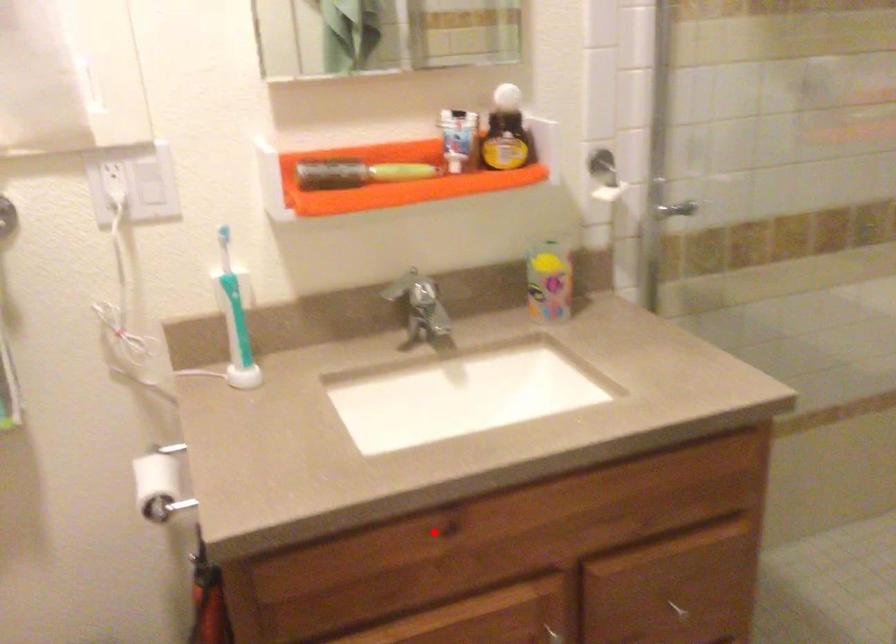
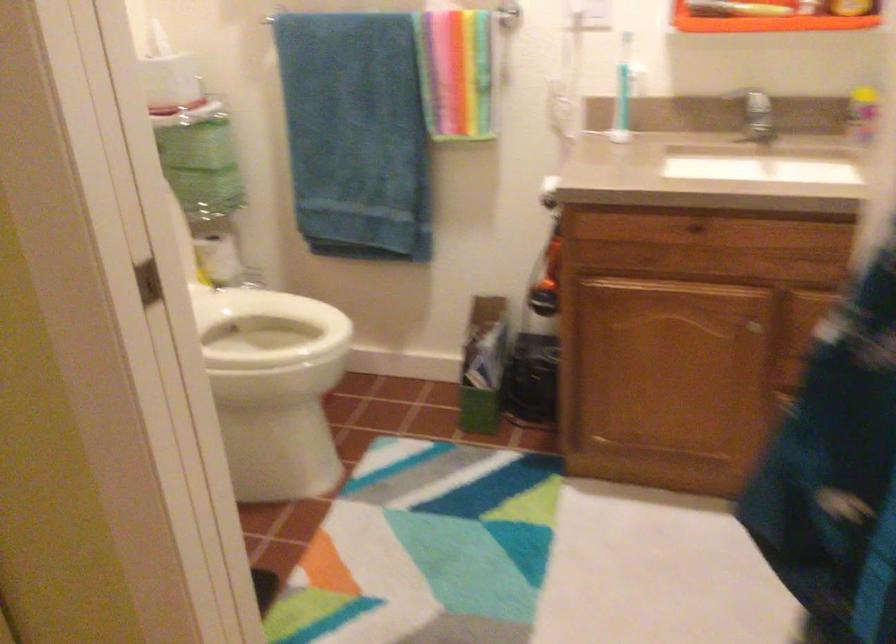
In the second image, find the point that corresponds to the highlighted location in the first image.

(692, 229)